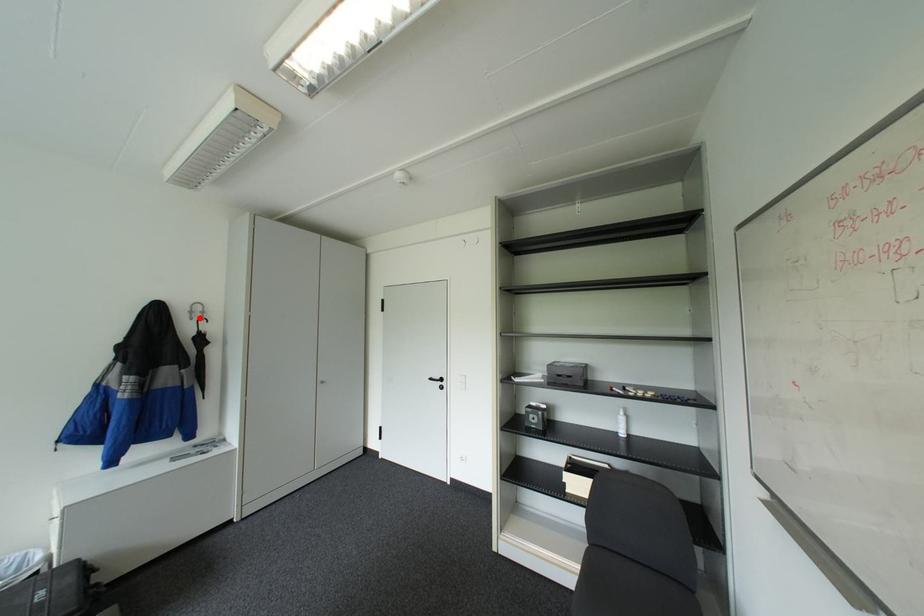
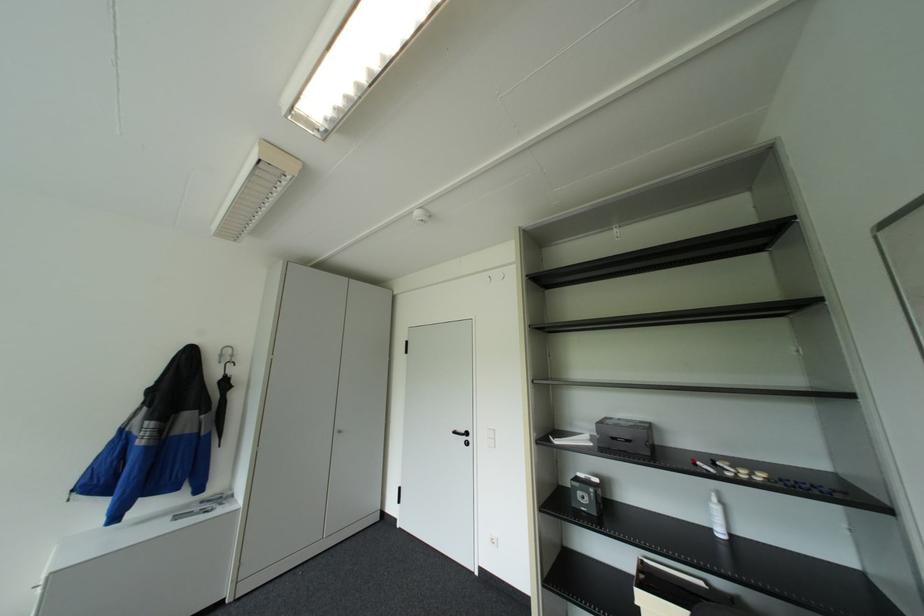
The point at the highlighted location is marked in the first image. Where is the corresponding point in the second image?

(227, 361)